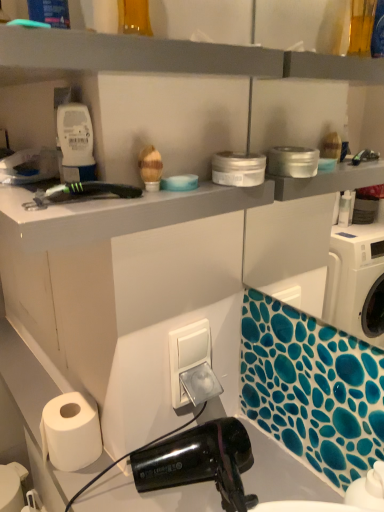
Question: Is white matte paper towel at lower left aimed at gray matte shelf at upper center?

Choices:
 (A) yes
 (B) no

Answer: (B)

Question: Is white matte paper towel at lower left closer to the viewer compared to gray matte shelf at upper center?

Choices:
 (A) no
 (B) yes

Answer: (A)

Question: Considering the relative sizes of white matte paper towel at lower left and gray matte shelf at upper center in the image provided, is white matte paper towel at lower left wider than gray matte shelf at upper center?

Choices:
 (A) yes
 (B) no

Answer: (B)

Question: Are white matte paper towel at lower left and gray matte shelf at upper center far apart?

Choices:
 (A) yes
 (B) no

Answer: (B)

Question: Does white matte paper towel at lower left have a lesser width compared to gray matte shelf at upper center?

Choices:
 (A) no
 (B) yes

Answer: (B)

Question: Looking at their shapes, would you say white plastic switch at center is wider or thinner than white matte paper towel at lower left?

Choices:
 (A) wide
 (B) thin

Answer: (B)

Question: Is point (182, 351) closer or farther from the camera than point (82, 418)?

Choices:
 (A) farther
 (B) closer

Answer: (B)

Question: Based on their sizes in the image, would you say white plastic switch at center is bigger or smaller than white matte paper towel at lower left?

Choices:
 (A) big
 (B) small

Answer: (B)

Question: In the image, is white plastic switch at center on the left side or the right side of white matte paper towel at lower left?

Choices:
 (A) right
 (B) left

Answer: (A)

Question: Relative to gray matte shelf at upper center, is white matte paper towel at lower left in front or behind?

Choices:
 (A) behind
 (B) front

Answer: (A)

Question: From the image's perspective, relative to gray matte shelf at upper center, is white matte paper towel at lower left above or below?

Choices:
 (A) below
 (B) above

Answer: (A)

Question: Considering the relative positions of white matte paper towel at lower left and gray matte shelf at upper center in the image provided, is white matte paper towel at lower left to the left or to the right of gray matte shelf at upper center?

Choices:
 (A) right
 (B) left

Answer: (A)

Question: From a real-world perspective, relative to gray matte shelf at upper center, is white matte paper towel at lower left vertically above or below?

Choices:
 (A) below
 (B) above

Answer: (A)

Question: Would you say white matte paper towel at lower left is inside or outside white plastic switch at center?

Choices:
 (A) outside
 (B) inside

Answer: (A)

Question: From a real-world perspective, relative to white plastic switch at center, is white matte paper towel at lower left vertically above or below?

Choices:
 (A) above
 (B) below

Answer: (B)